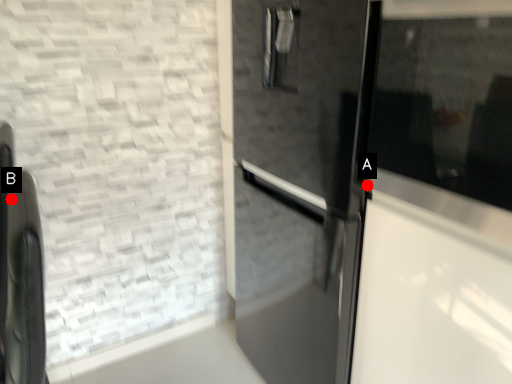
Question: Two points are circled on the image, labeled by A and B beside each circle. Which point is closer to the camera?

Choices:
 (A) A is closer
 (B) B is closer

Answer: (A)